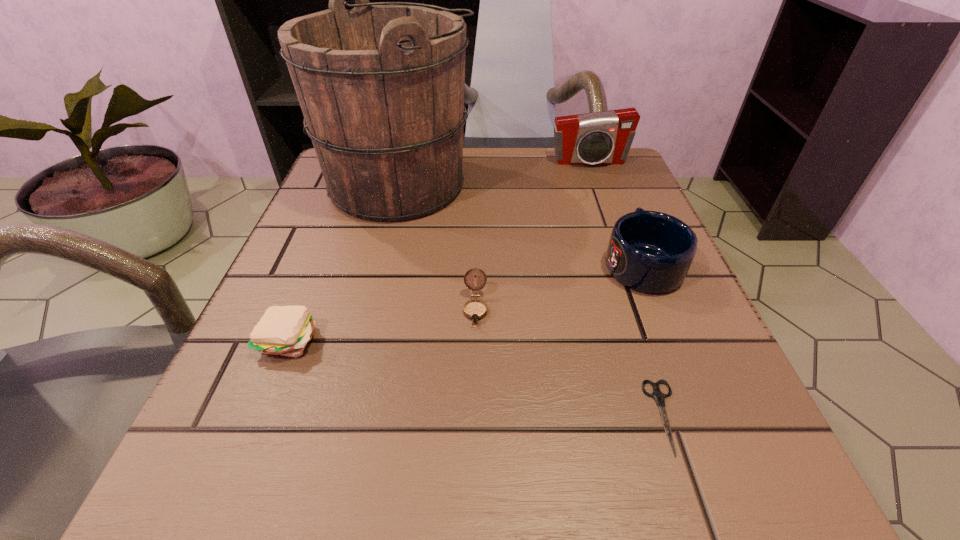
I want to click on camera that is at the right edge, so click(x=601, y=138).

Where is `mug located at the right edge`? mug located at the right edge is located at coordinates (651, 252).

Where is `shears located in the right edge section of the desktop`? This screenshot has height=540, width=960. shears located in the right edge section of the desktop is located at coordinates (659, 397).

The width and height of the screenshot is (960, 540). I want to click on object at the far left corner, so click(381, 86).

Identify the location of object that is positioned at the far right corner. Image resolution: width=960 pixels, height=540 pixels. (601, 138).

Find the location of a particular element. Image resolution: width=960 pixels, height=540 pixels. object that is positioned at the near right corner is located at coordinates (659, 397).

The image size is (960, 540). I want to click on vacant space at the far edge, so click(x=481, y=183).

Identify the location of vacant space at the near edge of the desktop. The height and width of the screenshot is (540, 960). (582, 474).

This screenshot has width=960, height=540. Find the location of `vacant space at the left edge of the desktop`. vacant space at the left edge of the desktop is located at coordinates (363, 259).

I want to click on free location at the right edge, so click(715, 357).